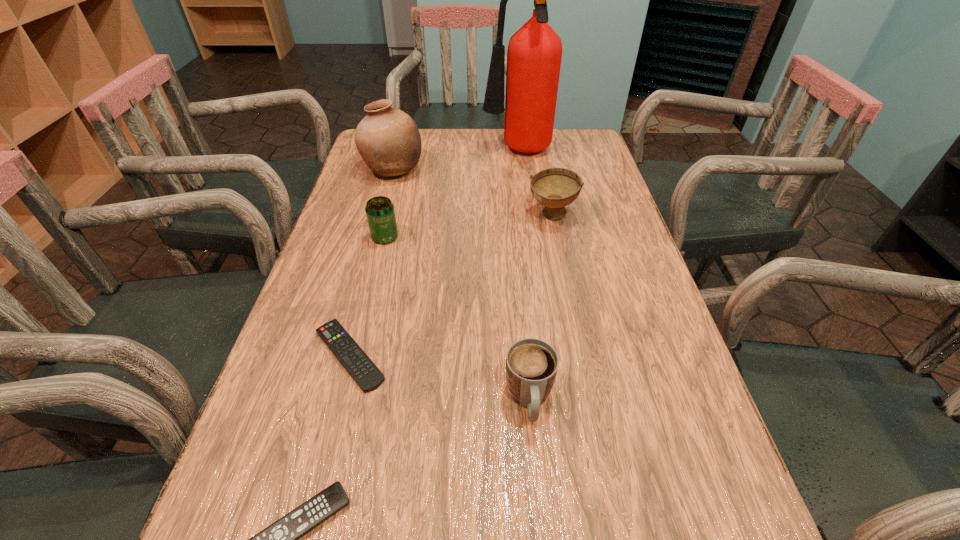
You are a GUI agent. You are given a task and a screenshot of the screen. Output one action in this format:
    pyautogui.click(x=<x>, y=<y>)
    Task: Click on the empty location between the mug and the sixth shortest object
    This screenshot has height=540, width=960.
    Given the screenshot: What is the action you would take?
    pyautogui.click(x=461, y=285)

In order to click on free point between the tallest object and the beer can in this screenshot , I will do `click(451, 194)`.

The width and height of the screenshot is (960, 540). What are the coordinates of `unoccupied position between the mug and the soup bowl` in the screenshot? It's located at (540, 308).

I want to click on vacant area that lies between the fire extinguisher and the mug, so click(523, 276).

Where is `vacant area that lies between the beer can and the soup bowl`? Image resolution: width=960 pixels, height=540 pixels. vacant area that lies between the beer can and the soup bowl is located at coordinates (x=468, y=226).

Select which object is the second closest to the farther remote control. Please provide its 2D coordinates. Your answer should be formatted as a tuple, i.e. [(x, y)], where the tuple contains the x and y coordinates of a point satisfying the conditions above.

[(531, 364)]

Locate which object ranks second in proximity to the tallest object. Please provide its 2D coordinates. Your answer should be formatted as a tuple, i.e. [(x, y)], where the tuple contains the x and y coordinates of a point satisfying the conditions above.

[(555, 188)]

Find the location of `vacant space that satisfies the following two spatial constraints: 1. at the nozzle of the fire extinguisher; 2. on the right side of the soup bowl`. vacant space that satisfies the following two spatial constraints: 1. at the nozzle of the fire extinguisher; 2. on the right side of the soup bowl is located at coordinates (525, 215).

Find the location of a particular element. The image size is (960, 540). vacant space that satisfies the following two spatial constraints: 1. on the back side of the beer can; 2. on the left side of the soup bowl is located at coordinates (390, 215).